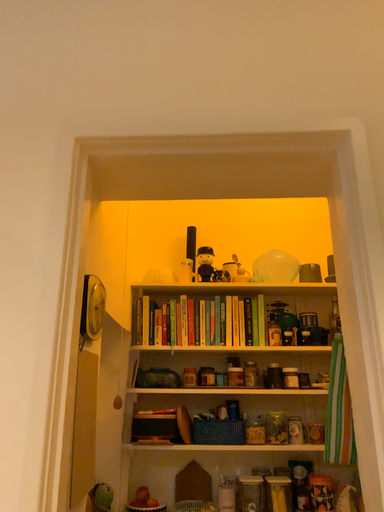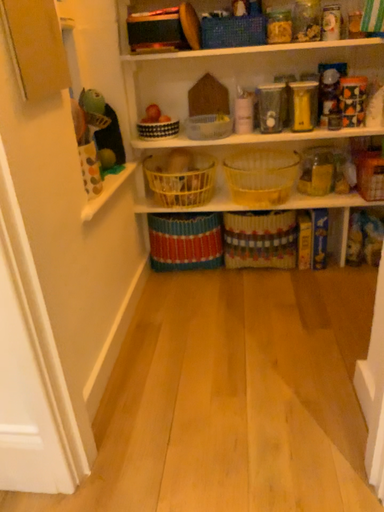
Question: How did the camera likely rotate when shooting the video?

Choices:
 (A) rotated downward
 (B) rotated upward

Answer: (A)